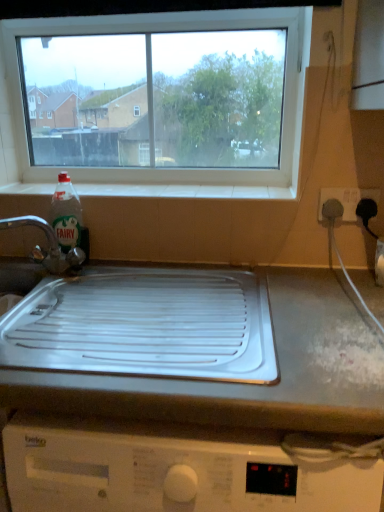
Question: Considering the positions of white plastic socket at right and brushed metal tap at left in the image, is white plastic socket at right wider or thinner than brushed metal tap at left?

Choices:
 (A) wide
 (B) thin

Answer: (B)

Question: From a real-world perspective, is white plastic socket at right positioned above or below brushed metal tap at left?

Choices:
 (A) above
 (B) below

Answer: (A)

Question: Which object is the farthest from the white plastic tray at center?

Choices:
 (A) transparent glass window at upper center
 (B) brushed metal tap at left
 (C) white plastic socket at right
 (D) clear plastic bottle at left
 (E) white tile at upper center

Answer: (C)

Question: Estimate the real-world distances between objects in this image. Which object is farther from the brushed metal tap at left?

Choices:
 (A) clear plastic bottle at left
 (B) white tile at upper center
 (C) white plastic tray at center
 (D) transparent glass window at upper center
 (E) white plastic socket at right

Answer: (E)